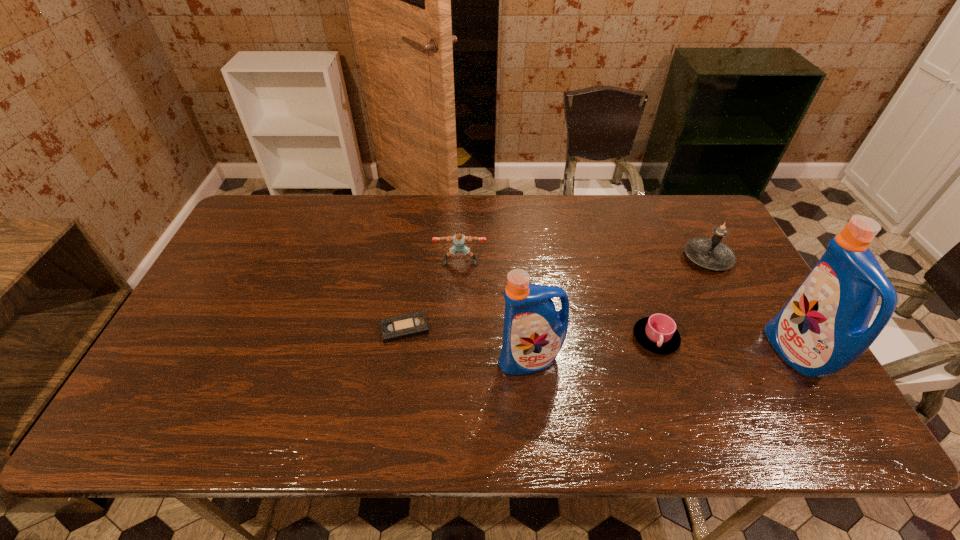
Find the location of a particular element. free point between the second tallest object and the videotape is located at coordinates (468, 345).

Locate an element on the screen. free space between the candle and the cup is located at coordinates (682, 298).

Locate an element on the screen. This screenshot has height=540, width=960. free area in between the shortest object and the right detergent is located at coordinates coord(600,341).

Where is `unoccupied area between the taller detergent and the shortest object`? The height and width of the screenshot is (540, 960). unoccupied area between the taller detergent and the shortest object is located at coordinates (600, 341).

At what (x,y) coordinates should I click in order to perform the action: click on free space between the third shortest object and the third object from right to left. Please return your answer as a coordinate pair (x, y). Looking at the image, I should click on (558, 300).

Choose which object is the second nearest neighbor to the fourth object from left to right. Please provide its 2D coordinates. Your answer should be formatted as a tuple, i.e. [(x, y)], where the tuple contains the x and y coordinates of a point satisfying the conditions above.

[(711, 253)]

Locate an element on the screen. The image size is (960, 540). object that stands as the fifth closest to the shorter detergent is located at coordinates (823, 328).